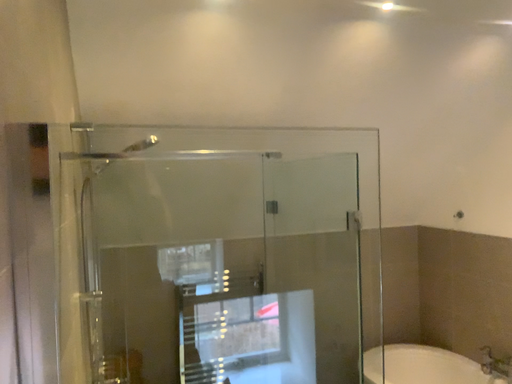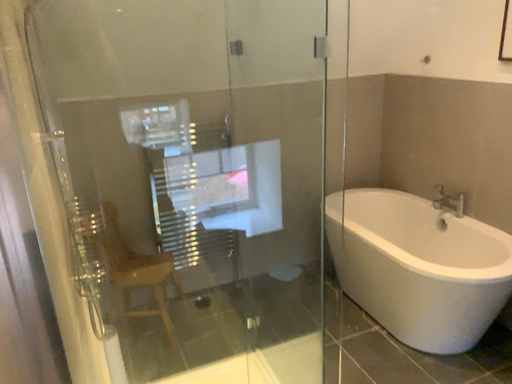
Question: How did the camera likely rotate when shooting the video?

Choices:
 (A) rotated downward
 (B) rotated upward

Answer: (A)